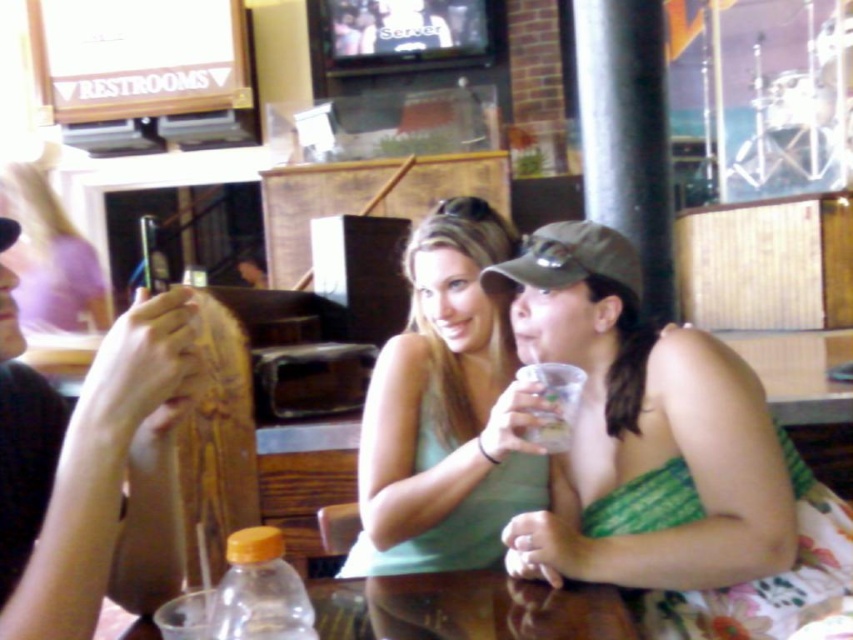
Question: Does green matte tank top at center have a greater width compared to matte green tank top at center?

Choices:
 (A) yes
 (B) no

Answer: (A)

Question: Can you confirm if brown wooden table at lower center is thinner than translucent plastic bottle at lower center?

Choices:
 (A) yes
 (B) no

Answer: (B)

Question: Which point is closer to the camera?

Choices:
 (A) (576, 612)
 (B) (299, 621)
 (C) (614, 376)
 (D) (560, 420)

Answer: (B)

Question: Which of these objects is positioned closest to the matte green tank top at center?

Choices:
 (A) translucent plastic bottle at lower center
 (B) green fabric dress at center
 (C) brown wooden table at lower center

Answer: (A)

Question: From the image, what is the correct spatial relationship of brown wooden table at lower center in relation to clear plastic cup at lower center?

Choices:
 (A) right
 (B) left

Answer: (B)

Question: Considering the real-world distances, which object is closest to the clear plastic cup at lower center?

Choices:
 (A) matte green tank top at center
 (B) green matte tank top at center
 (C) brown wooden table at lower center
 (D) translucent plastic bottle at lower center

Answer: (B)